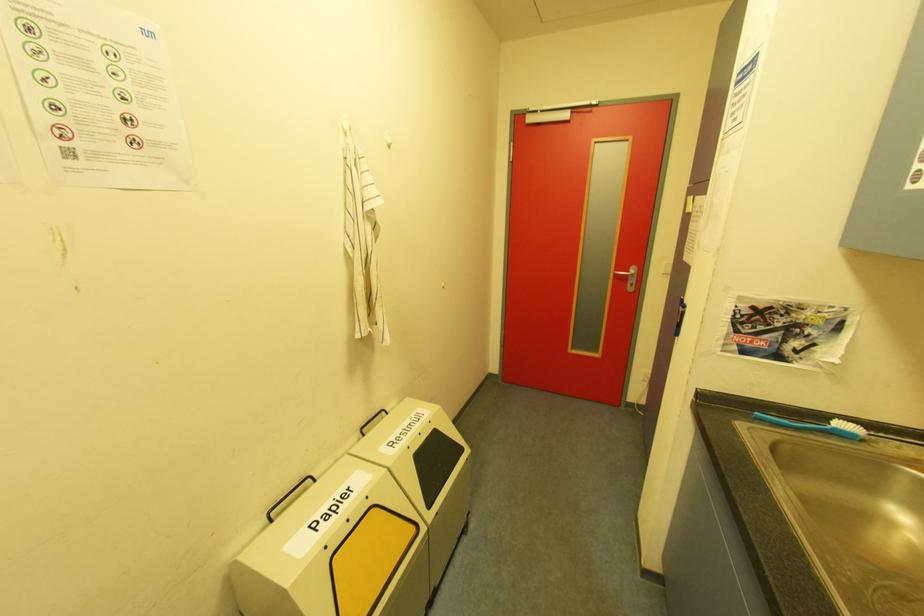
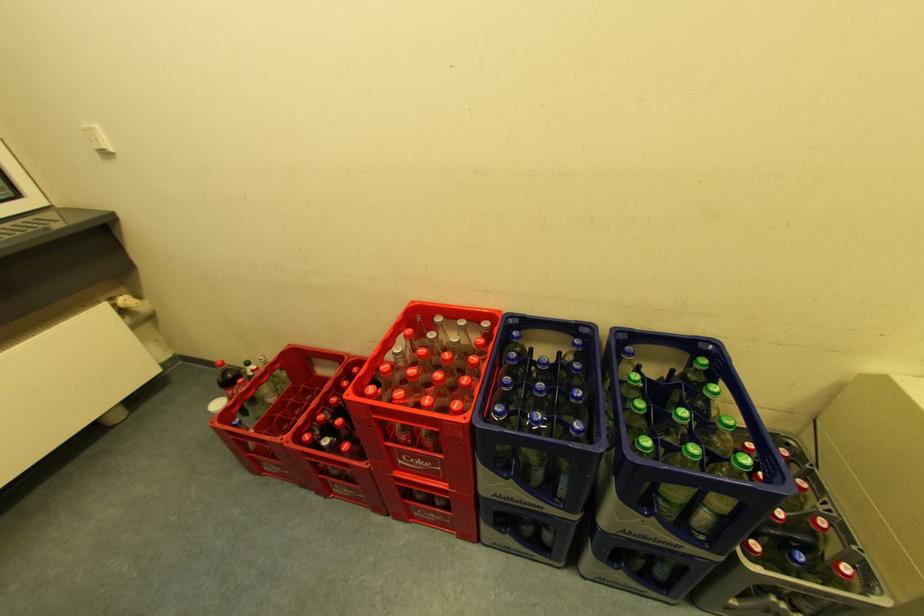
Based on the continuous images, in which direction is the camera rotating?

The rotation direction of the camera is left-down.